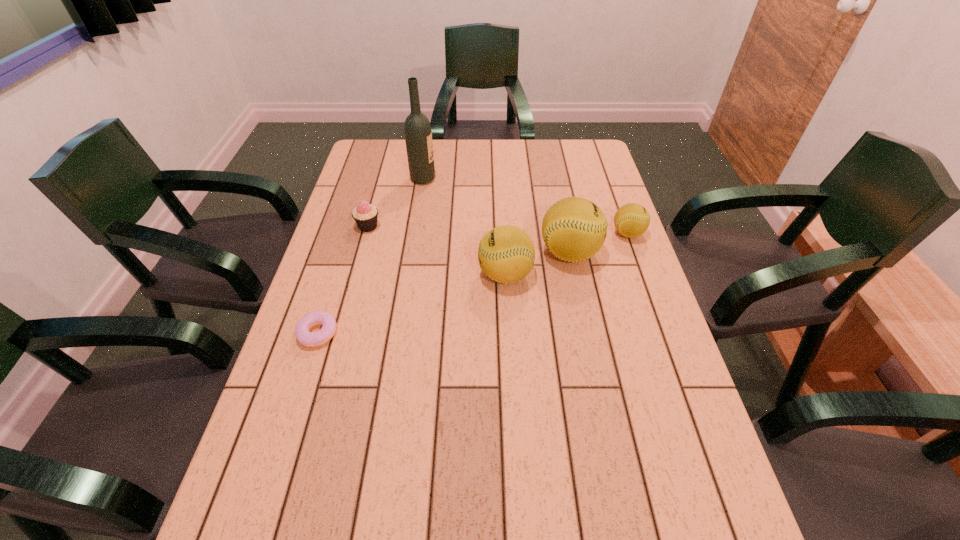
In the image, there is a desktop. At what (x,y) coordinates should I click in order to perform the action: click on free region at the far edge. Please return your answer as a coordinate pair (x, y). This screenshot has height=540, width=960. Looking at the image, I should click on (442, 146).

The image size is (960, 540). In the image, there is a desktop. What are the coordinates of `vacant region at the left edge` in the screenshot? It's located at (350, 363).

Find the location of a particular element. This screenshot has height=540, width=960. free location at the right edge of the desktop is located at coordinates (606, 190).

This screenshot has height=540, width=960. In order to click on vacant space at the near left corner of the desktop in this screenshot , I will do tap(306, 477).

The width and height of the screenshot is (960, 540). What are the coordinates of `vacant area at the far right corner` in the screenshot? It's located at (572, 159).

The width and height of the screenshot is (960, 540). Identify the location of vacant area between the shortest object and the cupcake. (343, 280).

Where is `free space between the cupcake and the farthest object`? free space between the cupcake and the farthest object is located at coordinates (396, 202).

The image size is (960, 540). Identify the location of vacant space that is in between the cupcake and the nearest object. (343, 280).

Find the location of a particular element. The image size is (960, 540). free area in between the leftmost softball and the fourth object from right to left is located at coordinates (464, 227).

The image size is (960, 540). Find the location of `free area in between the shortest object and the cupcake`. free area in between the shortest object and the cupcake is located at coordinates (343, 280).